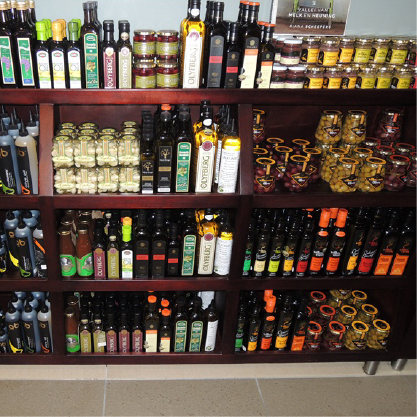
Locate an element on the screen. The height and width of the screenshot is (417, 417). oil and vinegar bottles is located at coordinates (22, 52), (62, 50), (89, 47), (113, 64), (216, 49), (235, 49).